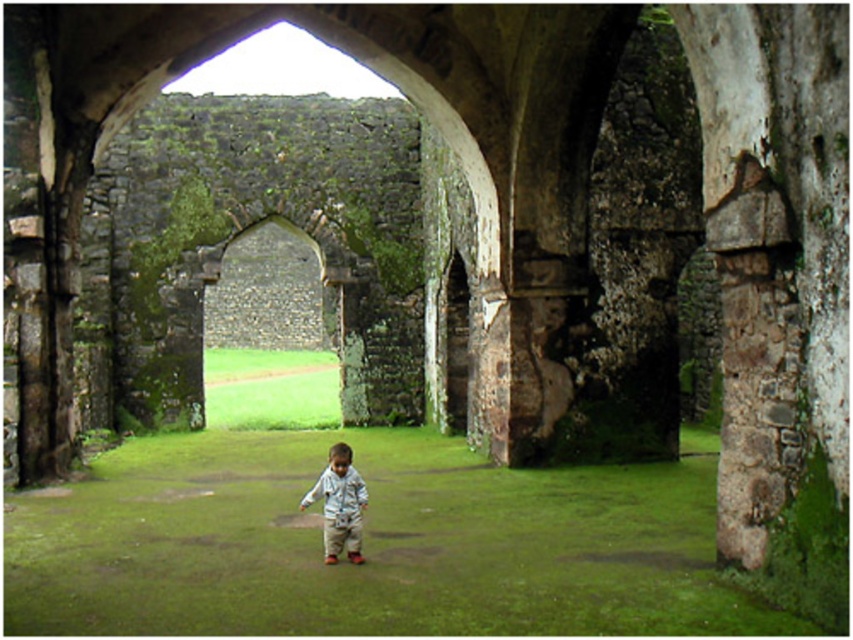
Question: Considering the relative positions of green grass at center and light blue fabric boy at center in the image provided, where is green grass at center located with respect to light blue fabric boy at center?

Choices:
 (A) right
 (B) left

Answer: (A)

Question: Which point is closer to the camera?

Choices:
 (A) (320, 486)
 (B) (125, 598)

Answer: (B)

Question: Is green grass at center further to the viewer compared to light blue fabric boy at center?

Choices:
 (A) yes
 (B) no

Answer: (B)

Question: Among these objects, which one is nearest to the camera?

Choices:
 (A) green grass at center
 (B) light blue fabric boy at center

Answer: (A)

Question: Does green grass at center have a smaller size compared to light blue fabric boy at center?

Choices:
 (A) yes
 (B) no

Answer: (B)

Question: Among these points, which one is farthest from the camera?

Choices:
 (A) (699, 611)
 (B) (300, 499)

Answer: (B)